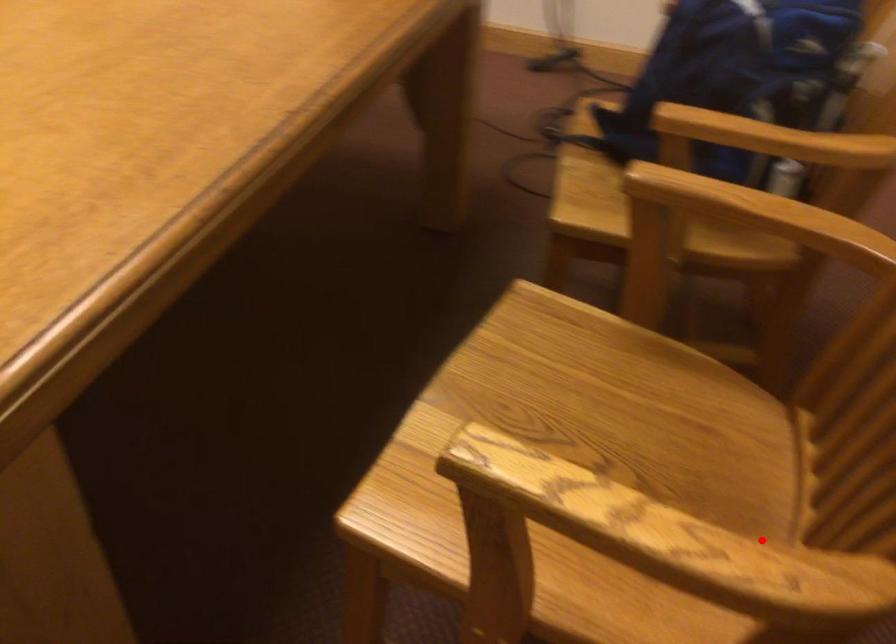
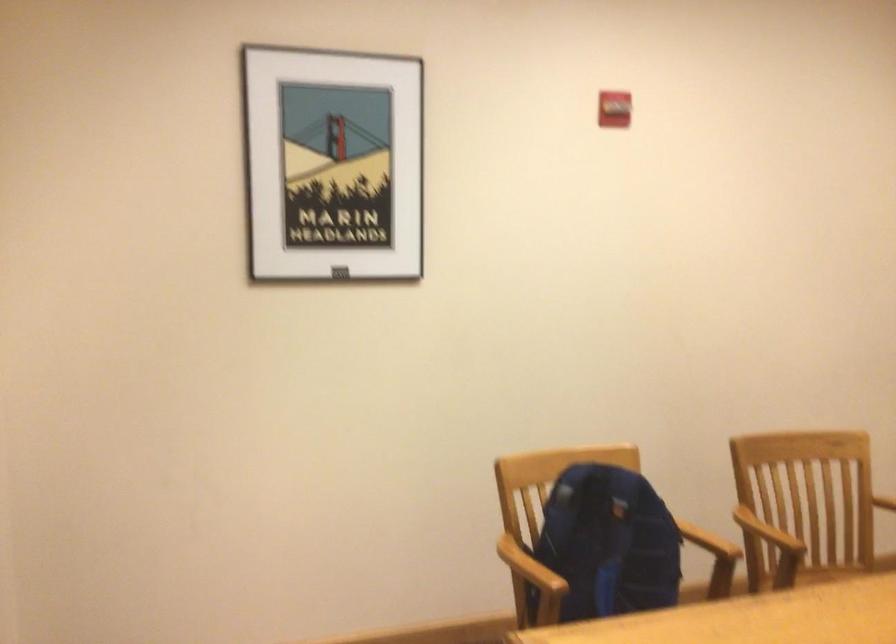
Question: I am providing you with two images of the same scene from different viewpoints. In image1, a red point is highlighted. Considering the same 3D point in image2, which of the following is correct?

Choices:
 (A) It is closer
 (B) It is farther

Answer: (B)